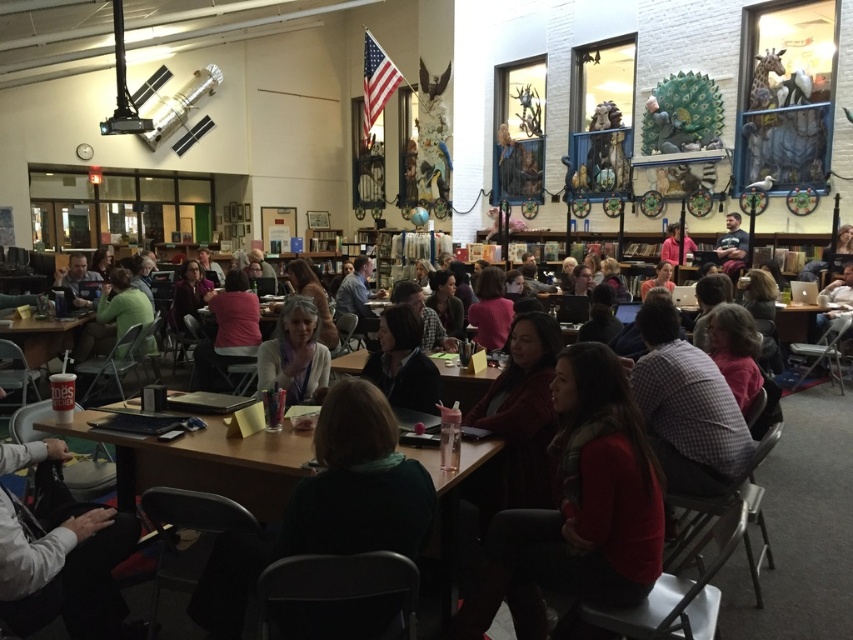
Question: Is red wool scarf at center bigger than wooden table at center?

Choices:
 (A) no
 (B) yes

Answer: (B)

Question: Is matte black jacket at center smaller than dark gray shirt at center?

Choices:
 (A) yes
 (B) no

Answer: (A)

Question: Is wooden table at center positioned behind matte black jacket at center?

Choices:
 (A) no
 (B) yes

Answer: (A)

Question: Which object is closer to the camera taking this photo?

Choices:
 (A) light beige sweater at center
 (B) matte black jacket at center
 (C) wooden table at center

Answer: (C)

Question: Which is nearer to the wooden table at center?

Choices:
 (A) red wool scarf at center
 (B) dark gray shirt at center
 (C) light beige sweater at center
 (D) matte black jacket at center

Answer: (C)

Question: Among these points, which one is farthest from the camera?

Choices:
 (A) (309, 381)
 (B) (728, 230)

Answer: (B)